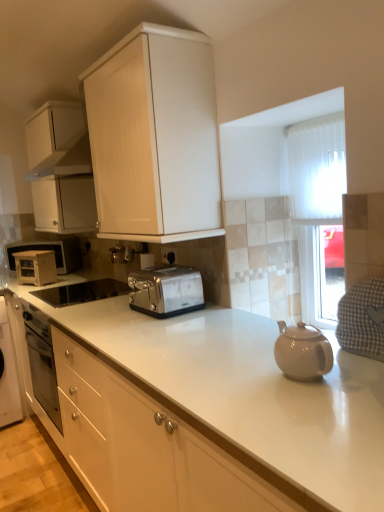
I want to click on free point above satin silver toaster at left, which ranks as the second appliance in back-to-front order (from a real-world perspective), so click(33, 253).